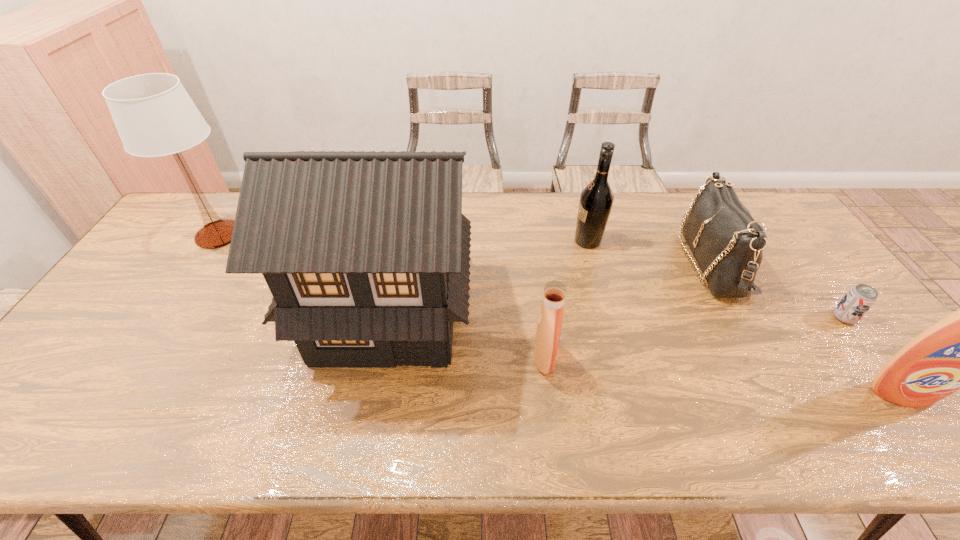
The width and height of the screenshot is (960, 540). I want to click on the shorter detergent, so click(549, 326).

Find the location of a particular element. The width and height of the screenshot is (960, 540). the left detergent is located at coordinates (549, 326).

Where is `the right detergent`? the right detergent is located at coordinates (958, 352).

I want to click on handbag, so (727, 243).

Identify the location of the fourth object from right to left. (596, 200).

Where is `dollhouse`? dollhouse is located at coordinates (366, 254).

The image size is (960, 540). What are the coordinates of `the leftmost object` in the screenshot? It's located at (154, 115).

I want to click on the shortest object, so point(859,299).

The width and height of the screenshot is (960, 540). I want to click on free space located on the front-facing side of the shorter detergent, so click(715, 358).

At what (x,y) coordinates should I click in order to perform the action: click on vacant area situated at the front of the handbag with chain and zipper. Please return your answer as a coordinate pair (x, y). This screenshot has width=960, height=540. Looking at the image, I should click on click(568, 262).